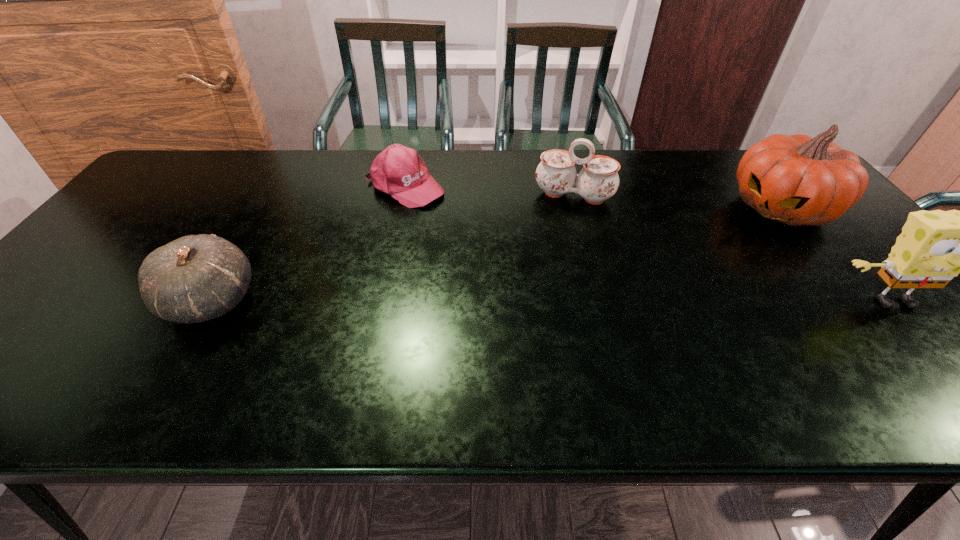
Find the location of `object present at the far right corner`. object present at the far right corner is located at coordinates (797, 180).

Image resolution: width=960 pixels, height=540 pixels. In the image, there is a desktop. Find the location of `vacant space at the far edge`. vacant space at the far edge is located at coordinates (320, 177).

What are the coordinates of `vacant space at the near edge of the desktop` in the screenshot? It's located at (432, 332).

This screenshot has width=960, height=540. I want to click on vacant space at the left edge, so click(x=149, y=193).

This screenshot has height=540, width=960. What are the coordinates of `vacant space at the right edge` in the screenshot? It's located at (863, 275).

The height and width of the screenshot is (540, 960). Find the location of `free space between the fourth object from right to left and the chinaware`. free space between the fourth object from right to left and the chinaware is located at coordinates (490, 191).

Where is `free area in between the gourd and the shortest object`? Image resolution: width=960 pixels, height=540 pixels. free area in between the gourd and the shortest object is located at coordinates (308, 244).

Locate an element on the screen. The width and height of the screenshot is (960, 540). empty space that is in between the gourd and the shortest object is located at coordinates (308, 244).

The image size is (960, 540). I want to click on free space between the gourd and the third object from left to right, so click(x=393, y=248).

This screenshot has height=540, width=960. In order to click on vacant area that lies between the gourd and the fourth object from right to left in this screenshot , I will do `click(308, 244)`.